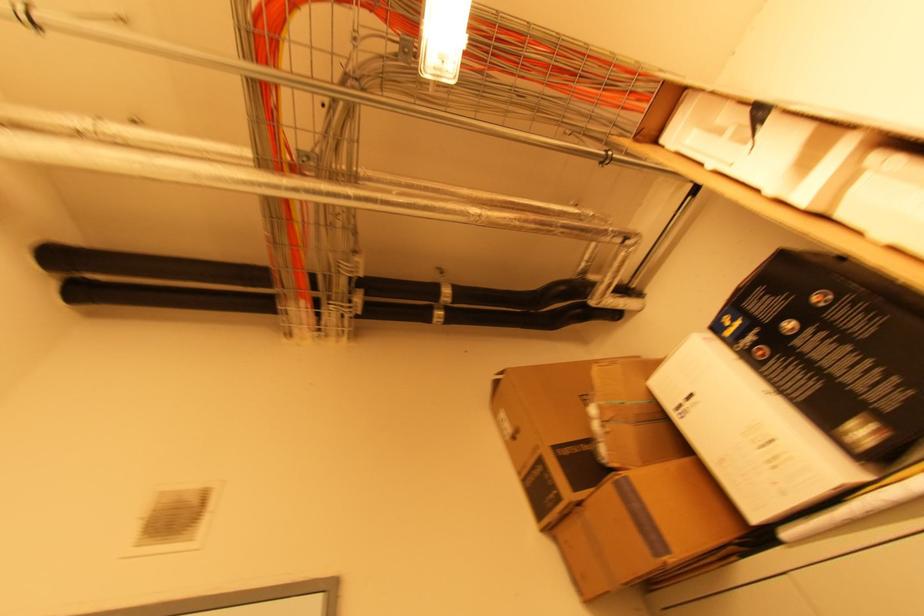
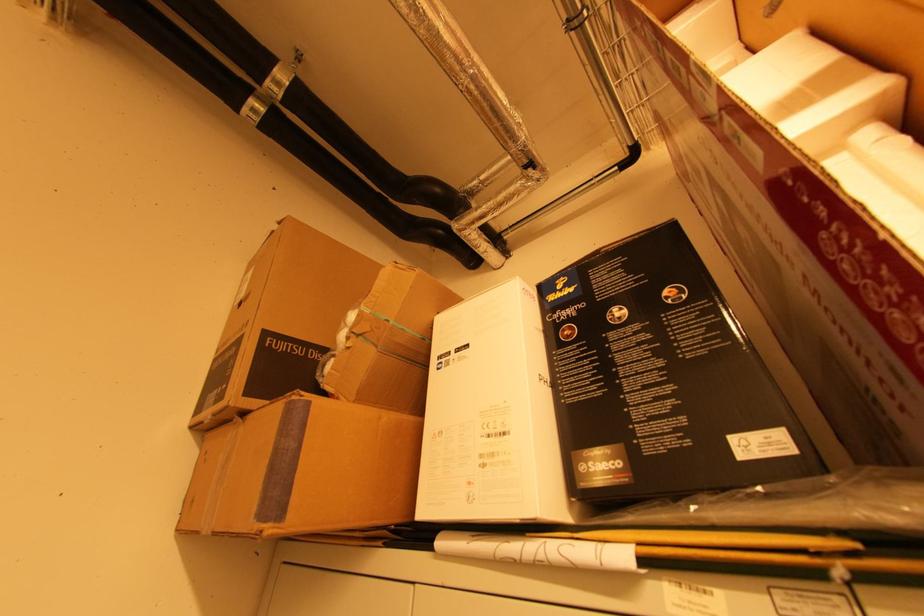
The point at (x=650, y=379) is marked in the first image. Where is the corresponding point in the second image?

(441, 313)